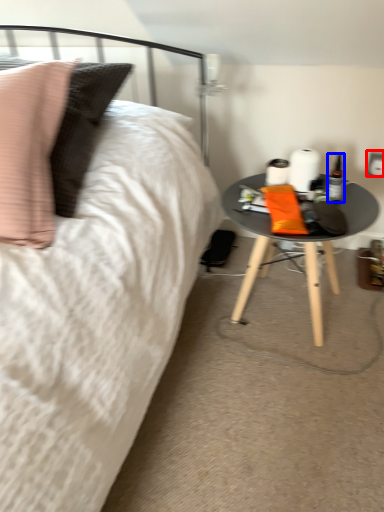
Question: Which object is further to the camera taking this photo, electric outlet (highlighted by a red box) or bottle (highlighted by a blue box)?

Choices:
 (A) electric outlet
 (B) bottle

Answer: (A)